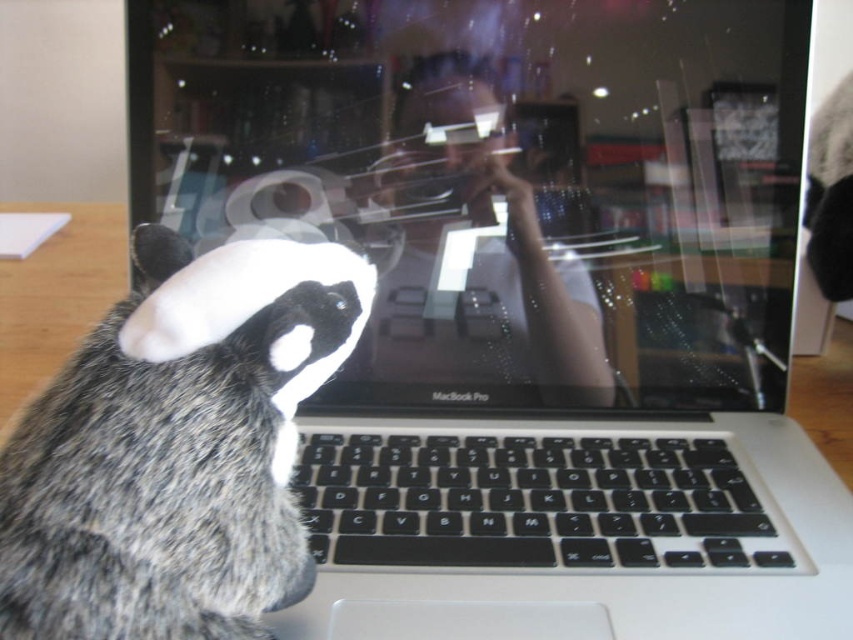
You are a photographer trying to capture the guinea pig and the MacBook Pro in the image. The cat is at point (177, 448). Where should you position yourself to ensure both the guinea pig and the MacBook Pro are in frame while avoiding the cat?

Position yourself so that the cat at point (177, 448) is outside the frame. Ensure the guinea pig and MacBook Pro remain centered or within the main area of the photo.